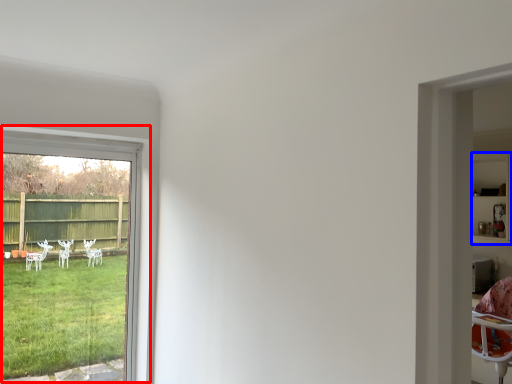
Question: Which point is further to the camera, window (highlighted by a red box) or shelf (highlighted by a blue box)?

Choices:
 (A) window
 (B) shelf

Answer: (B)